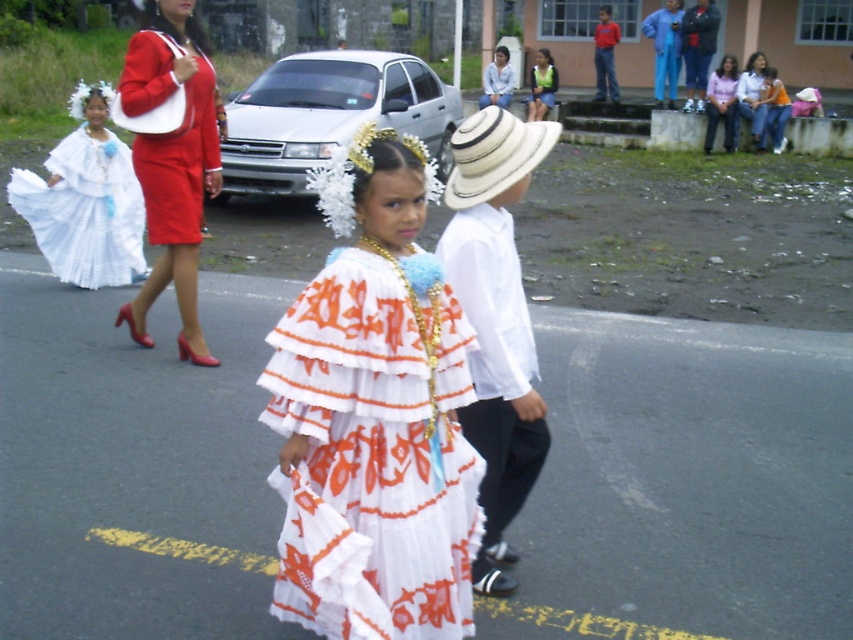
Is white cotton shirt at center taller than white cotton dress at left?

Yes.

Is white cotton shirt at center above white cotton dress at left?

No.

Between point (534, 476) and point (103, 248), which one is positioned in front?

Point (534, 476) is more forward.

Where is `white cotton shirt at center`? This screenshot has height=640, width=853. white cotton shirt at center is located at coordinates [496, 320].

Measure the distance between blue fabric pants at upper right and white cotton blouse at upper center.

blue fabric pants at upper right and white cotton blouse at upper center are 2.88 meters apart from each other.

Who is more distant from viewer, (656, 102) or (485, 96)?

The point (485, 96) is more distant.

Where is `blue fabric pants at upper right`? The image size is (853, 640). blue fabric pants at upper right is located at coordinates (664, 49).

Is white cotton shirt at center to the right of white straw hat at center from the viewer's perspective?

Yes, white cotton shirt at center is to the right of white straw hat at center.

Measure the distance from white cotton shirt at center to white straw hat at center.

white cotton shirt at center and white straw hat at center are 23.01 inches apart.

Who is more forward, (515, 156) or (502, 112)?

Point (515, 156) is in front.

Identify the location of white cotton shirt at center. Image resolution: width=853 pixels, height=640 pixels. (496, 320).